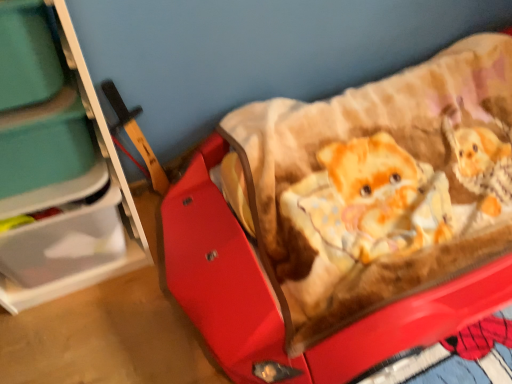
Question: Considering the relative positions of red plastic baby carriage at center and teal plastic storage box at left in the image provided, is red plastic baby carriage at center to the right of teal plastic storage box at left from the viewer's perspective?

Choices:
 (A) no
 (B) yes

Answer: (B)

Question: From the image's perspective, does red plastic baby carriage at center appear lower than teal plastic storage box at left?

Choices:
 (A) no
 (B) yes

Answer: (B)

Question: Does red plastic baby carriage at center have a smaller size compared to teal plastic storage box at left?

Choices:
 (A) no
 (B) yes

Answer: (A)

Question: Is red plastic baby carriage at center taller than teal plastic storage box at left?

Choices:
 (A) no
 (B) yes

Answer: (B)

Question: From a real-world perspective, is red plastic baby carriage at center on teal plastic storage box at left?

Choices:
 (A) no
 (B) yes

Answer: (A)

Question: In the image, is teal plastic storage box at left positioned in front of or behind translucent plastic storage at left?

Choices:
 (A) front
 (B) behind

Answer: (B)

Question: Based on their sizes in the image, would you say teal plastic storage box at left is bigger or smaller than translucent plastic storage at left?

Choices:
 (A) big
 (B) small

Answer: (B)

Question: Is teal plastic storage box at left to the left or to the right of translucent plastic storage at left in the image?

Choices:
 (A) left
 (B) right

Answer: (B)

Question: Is point (52, 109) closer or farther from the camera than point (101, 180)?

Choices:
 (A) closer
 (B) farther

Answer: (A)

Question: Looking at their shapes, would you say translucent plastic storage at left is wider or thinner than red plastic baby carriage at center?

Choices:
 (A) thin
 (B) wide

Answer: (A)

Question: From a real-world perspective, is translucent plastic storage at left above or below red plastic baby carriage at center?

Choices:
 (A) above
 (B) below

Answer: (A)

Question: In terms of height, does translucent plastic storage at left look taller or shorter compared to red plastic baby carriage at center?

Choices:
 (A) short
 (B) tall

Answer: (B)

Question: Is translucent plastic storage at left bigger or smaller than red plastic baby carriage at center?

Choices:
 (A) big
 (B) small

Answer: (B)

Question: Considering the positions of teal plastic storage box at left and red plastic baby carriage at center in the image, is teal plastic storage box at left taller or shorter than red plastic baby carriage at center?

Choices:
 (A) tall
 (B) short

Answer: (B)

Question: Choose the correct answer: Is teal plastic storage box at left inside red plastic baby carriage at center or outside it?

Choices:
 (A) outside
 (B) inside

Answer: (A)